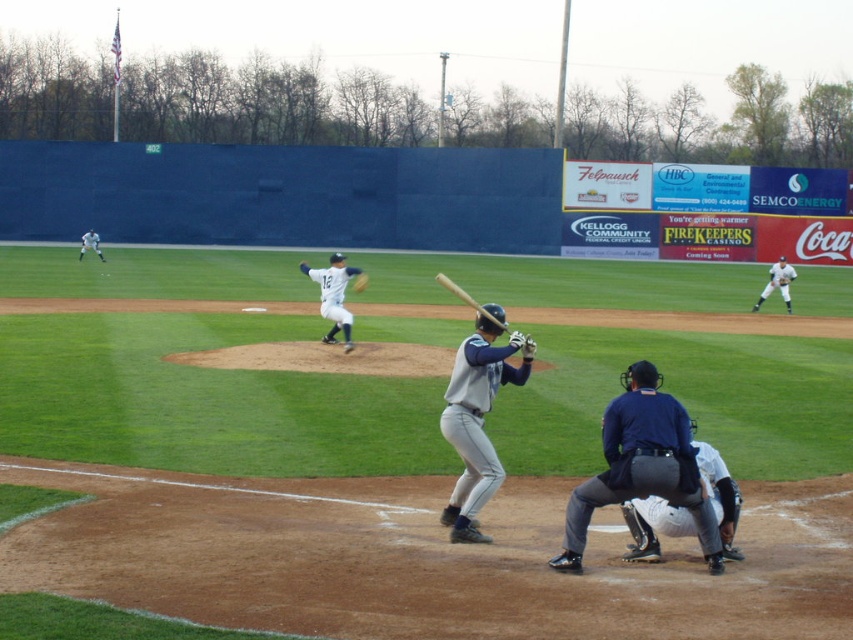
You are a spectator at the baseball game and want to take a photo of the white matte baseball pitcher at center and the dark brown leather glove at center. Which object is positioned to the left side in the image?

The white matte baseball pitcher at center is positioned to the left of the dark brown leather glove at center.

You are a photographer standing behind the black leather umpire at lower center and want to take a photo of the white uniform at right. Since you can only move sideways, can you shift to your left to get a better angle without blocking the umpire?

The black leather umpire at lower center has a lesser width compared to the white uniform at right, so yes, you can shift to your left to get a better angle without blocking the umpire because the umpire is narrower than the white uniform at right.

You are a baseball player standing at home plate and you see two points marked on the field, point (642, 369) and point (764, 285). Which point is closer to you?

Point (642, 369) is in front of point (764, 285), so it is closer to you.